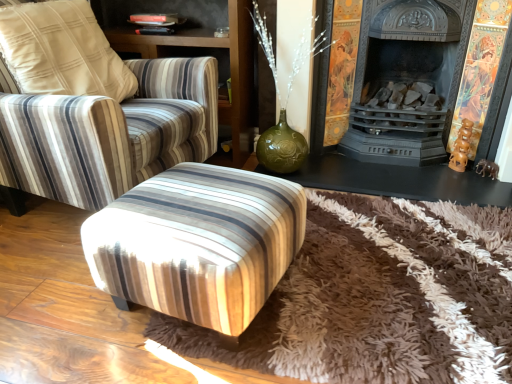
Question: Based on their positions, is striped fabric chair at center located to the left or right of black cast iron fireplace at center?

Choices:
 (A) right
 (B) left

Answer: (B)

Question: Is striped fabric chair at center spatially inside black cast iron fireplace at center, or outside of it?

Choices:
 (A) outside
 (B) inside

Answer: (A)

Question: Which of these objects is positioned farthest from the striped fabric armchair at upper left?

Choices:
 (A) striped fabric chair at center
 (B) wooden stool at center
 (C) black cast iron fireplace at center
 (D) matte black fireplace at center
 (E) brown shaggy rug at center

Answer: (E)

Question: Considering the real-world distances, which object is farthest from the matte black fireplace at center?

Choices:
 (A) wooden stool at center
 (B) brown shaggy rug at center
 (C) black cast iron fireplace at center
 (D) striped fabric armchair at upper left
 (E) striped fabric chair at center

Answer: (A)